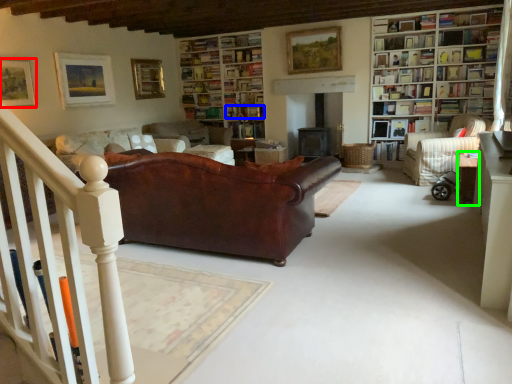
Question: Based on their relative distances, which object is nearer to picture frame (highlighted by a red box)? Choose from book (highlighted by a blue box) and table (highlighted by a green box).

Choices:
 (A) book
 (B) table

Answer: (A)